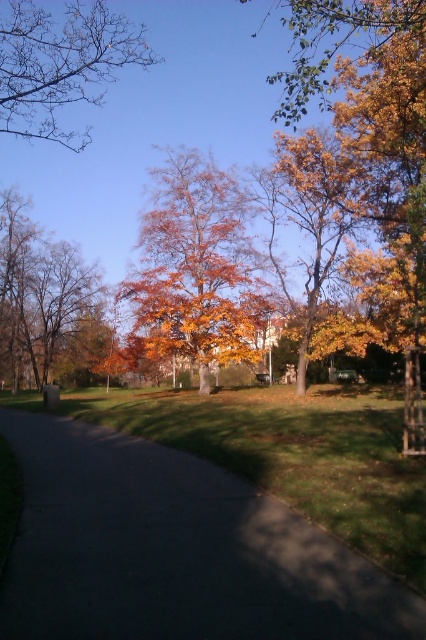
Between point (65, 77) and point (3, 305), which one is positioned in front?

Point (65, 77) is more forward.

Is point (39, 22) closer to camera compared to point (17, 227)?

That is True.

The width and height of the screenshot is (426, 640). I want to click on bare branches at upper left, so click(x=60, y=64).

Is orange leafy tree at center in front of bare branches at upper left?

No, it is not.

Is point (222, 292) less distant than point (57, 20)?

That is False.

Locate an element on the screen. This screenshot has width=426, height=640. orange leafy tree at center is located at coordinates (195, 268).

Is point (85, 604) closer to camera compared to point (74, 26)?

Yes, point (85, 604) is in front of point (74, 26).

Which is more to the right, dark asphalt path at center or bare branches at upper left?

From the viewer's perspective, dark asphalt path at center appears more on the right side.

Image resolution: width=426 pixels, height=640 pixels. What do you see at coordinates (175, 550) in the screenshot? I see `dark asphalt path at center` at bounding box center [175, 550].

Identify the location of dark asphalt path at center. Image resolution: width=426 pixels, height=640 pixels. (175, 550).